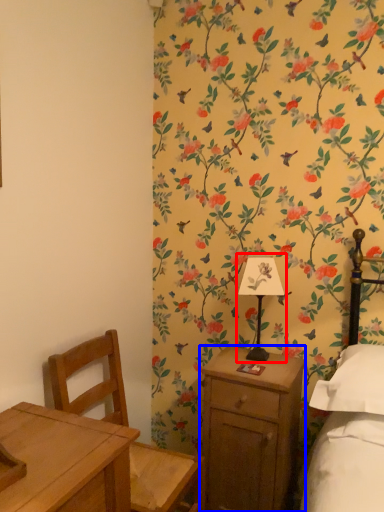
Question: Which point is closer to the camera, bedside lamp (highlighted by a red box) or nightstand (highlighted by a blue box)?

Choices:
 (A) bedside lamp
 (B) nightstand

Answer: (B)